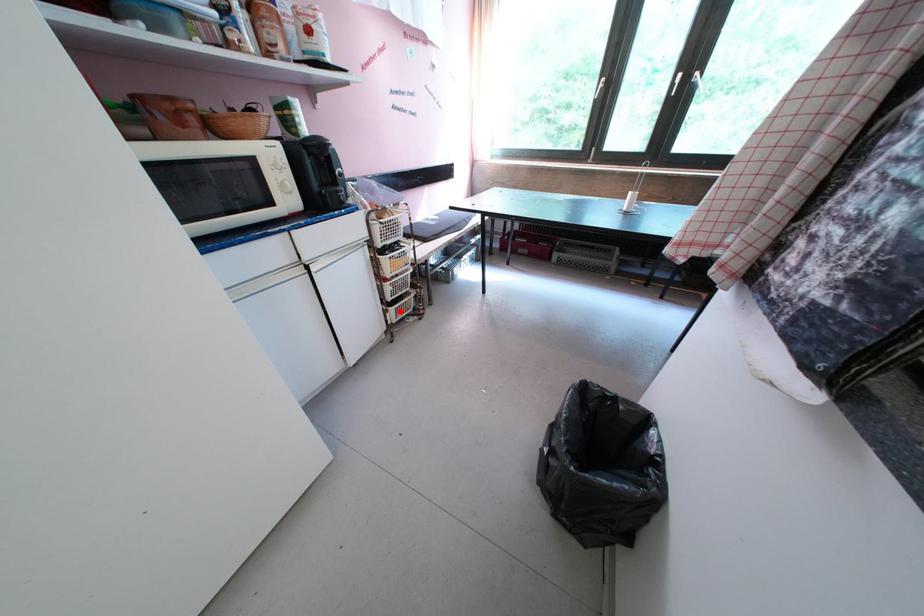
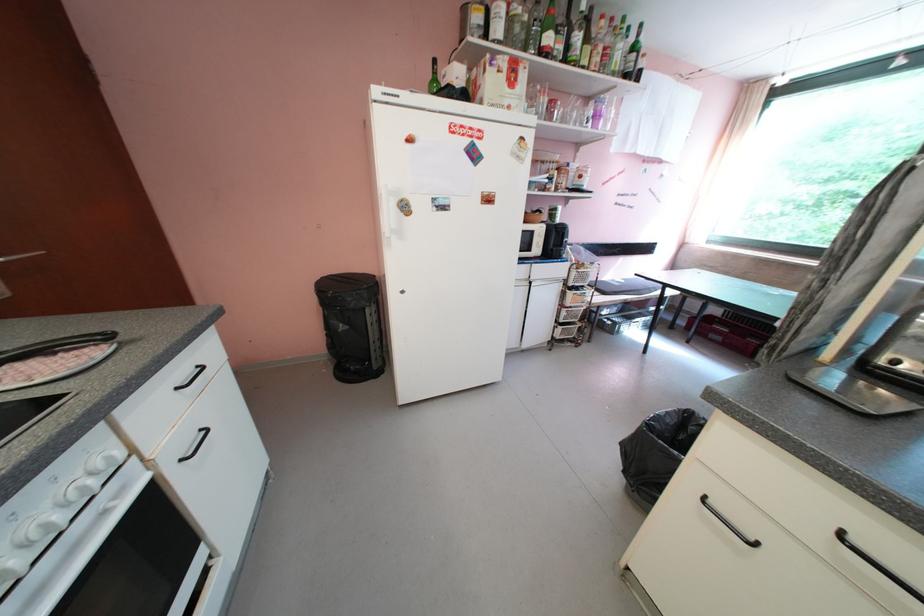
Locate, in the second image, the point that corresponds to the highlighted location in the first image.

(568, 330)